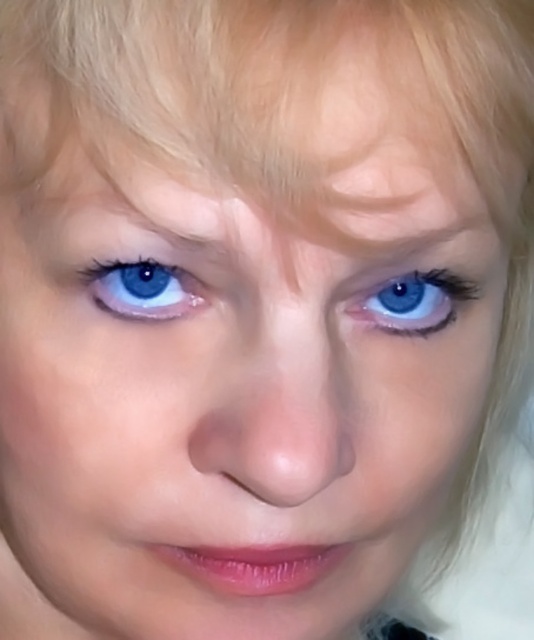
Which of these two, blue glossy eye at center or blue glossy eye at upper left, stands taller?

blue glossy eye at center

Does point (409, 308) come behind point (174, 300)?

Yes, it is behind point (174, 300).

Is point (363, 310) farther from viewer compared to point (139, 262)?

Yes, point (363, 310) is farther from viewer.

Find the location of a particular element. The width and height of the screenshot is (534, 640). blue glossy eye at center is located at coordinates (412, 301).